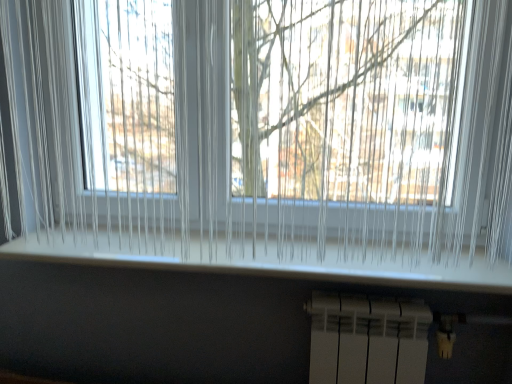
Question: From the image's perspective, is white plastic window sill at center located above or below white plastic radiator at bottom?

Choices:
 (A) below
 (B) above

Answer: (B)

Question: Considering the positions of white plastic window sill at center and white plastic radiator at bottom in the image, is white plastic window sill at center taller or shorter than white plastic radiator at bottom?

Choices:
 (A) short
 (B) tall

Answer: (A)

Question: Considering their positions, is white plastic window sill at center located in front of or behind white plastic radiator at bottom?

Choices:
 (A) behind
 (B) front

Answer: (B)

Question: Is white plastic radiator at bottom wider or thinner than white plastic window sill at center?

Choices:
 (A) thin
 (B) wide

Answer: (A)

Question: From the image's perspective, is white plastic radiator at bottom above or below white plastic window sill at center?

Choices:
 (A) above
 (B) below

Answer: (B)

Question: From a real-world perspective, is white plastic radiator at bottom physically located above or below white plastic window sill at center?

Choices:
 (A) above
 (B) below

Answer: (B)

Question: Is white plastic radiator at bottom to the left or to the right of white plastic window sill at center in the image?

Choices:
 (A) left
 (B) right

Answer: (B)